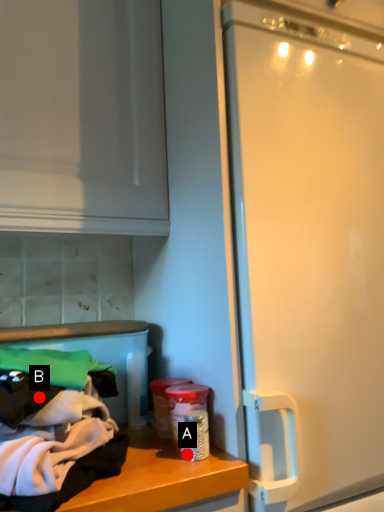
Question: Two points are circled on the image, labeled by A and B beside each circle. Which point is farther from the camera taking this photo?

Choices:
 (A) A is further
 (B) B is further

Answer: (A)